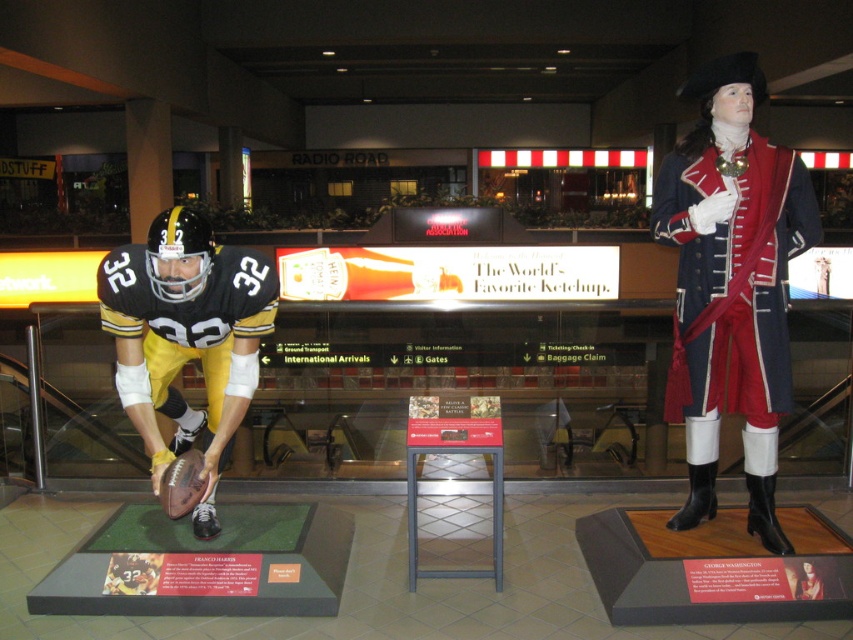
Question: Is blue wool coat at right above matte black uniform at left?

Choices:
 (A) yes
 (B) no

Answer: (A)

Question: Which of the following is the closest to the observer?

Choices:
 (A) blue wool coat at right
 (B) matte black uniform at left

Answer: (B)

Question: Does blue wool coat at right have a larger size compared to matte black uniform at left?

Choices:
 (A) no
 (B) yes

Answer: (B)

Question: Does blue wool coat at right lie behind matte black uniform at left?

Choices:
 (A) yes
 (B) no

Answer: (A)

Question: Which point is farther to the camera?

Choices:
 (A) (700, 316)
 (B) (265, 317)

Answer: (A)